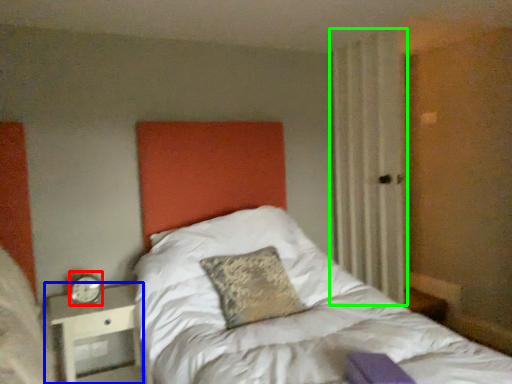
Question: Which object is the closest to the alarm clock (highlighted by a red box)? Choose among these: nightstand (highlighted by a blue box) or curtain (highlighted by a green box).

Choices:
 (A) nightstand
 (B) curtain

Answer: (A)